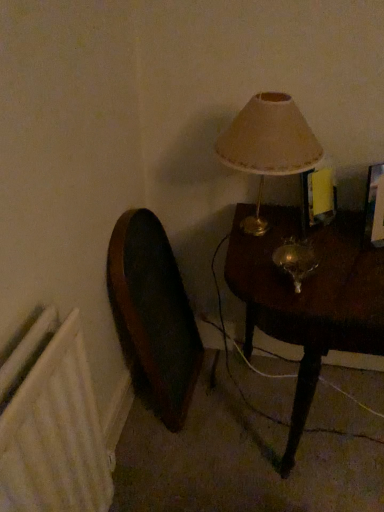
Question: Considering the relative sizes of white textured radiator at lower left and wooden swivel chair at left in the image provided, is white textured radiator at lower left bigger than wooden swivel chair at left?

Choices:
 (A) no
 (B) yes

Answer: (A)

Question: Considering the relative sizes of white textured radiator at lower left and wooden swivel chair at left in the image provided, is white textured radiator at lower left smaller than wooden swivel chair at left?

Choices:
 (A) no
 (B) yes

Answer: (B)

Question: Is white textured radiator at lower left thinner than wooden swivel chair at left?

Choices:
 (A) yes
 (B) no

Answer: (A)

Question: From the image's perspective, is white textured radiator at lower left above wooden swivel chair at left?

Choices:
 (A) no
 (B) yes

Answer: (A)

Question: Is wooden swivel chair at left completely or partially inside white textured radiator at lower left?

Choices:
 (A) no
 (B) yes

Answer: (A)

Question: In terms of size, does matte beige lampshade at upper right appear bigger or smaller than mahogany wood table at right?

Choices:
 (A) small
 (B) big

Answer: (A)

Question: In the image, is matte beige lampshade at upper right positioned in front of or behind mahogany wood table at right?

Choices:
 (A) front
 (B) behind

Answer: (B)

Question: Looking at their shapes, would you say matte beige lampshade at upper right is wider or thinner than mahogany wood table at right?

Choices:
 (A) wide
 (B) thin

Answer: (B)

Question: From the image's perspective, is matte beige lampshade at upper right positioned above or below mahogany wood table at right?

Choices:
 (A) below
 (B) above

Answer: (B)

Question: Relative to mahogany wood table at right, is wooden swivel chair at left in front or behind?

Choices:
 (A) behind
 (B) front

Answer: (A)

Question: Considering the positions of wooden swivel chair at left and mahogany wood table at right in the image, is wooden swivel chair at left taller or shorter than mahogany wood table at right?

Choices:
 (A) tall
 (B) short

Answer: (A)

Question: Is point (129, 283) positioned closer to the camera than point (294, 323)?

Choices:
 (A) closer
 (B) farther

Answer: (B)

Question: Do you think wooden swivel chair at left is within mahogany wood table at right, or outside of it?

Choices:
 (A) inside
 (B) outside

Answer: (B)

Question: From a real-world perspective, is mahogany wood table at right above or below white textured radiator at lower left?

Choices:
 (A) above
 (B) below

Answer: (B)

Question: From the image's perspective, is mahogany wood table at right located above or below white textured radiator at lower left?

Choices:
 (A) below
 (B) above

Answer: (B)